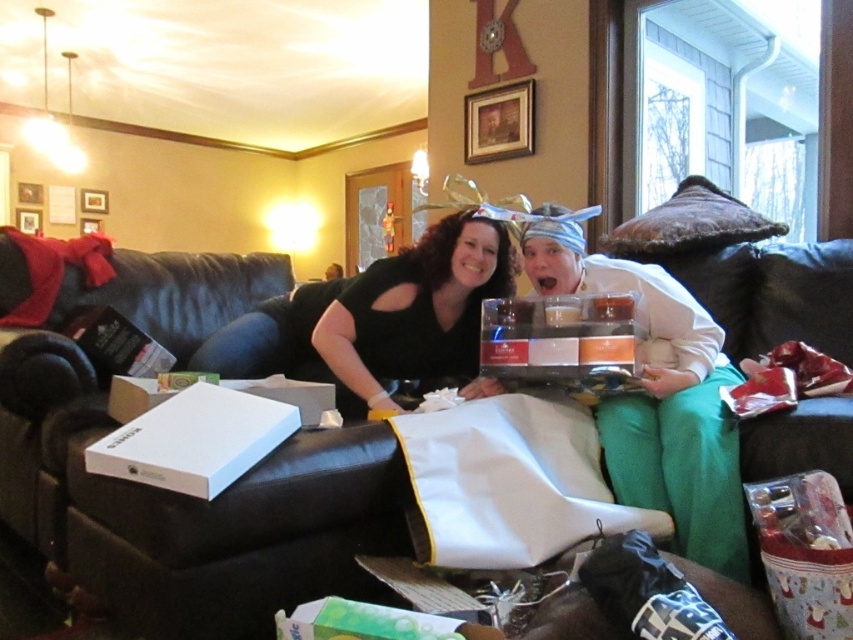
You are a delivery robot with a package that needs to be placed between the matte white tray at center and the black matte shirt at center. The package is 40 centimeters long. Can you fit it between them?

The matte white tray at center and black matte shirt at center are 39.22 centimeters apart. Since the package is 40 centimeters long, it cannot fit between them as the distance is slightly less than the package length.

You are a guest at a festive gathering and see the matte white tray at center and the black matte shirt at center. If you want to reach the tray first, which object should you move toward first?

The matte white tray at center is to the right of the black matte shirt at center. To reach the tray first, you should move toward the matte white tray at center directly since it is already positioned to the right of the shirt.

You are a photographer positioned in front of the black leather couch at center and the black matte shirt at center. Which object would appear larger in your photo?

The black leather couch at center would appear larger in the photo because it is closer to the viewer than the black matte shirt at center.